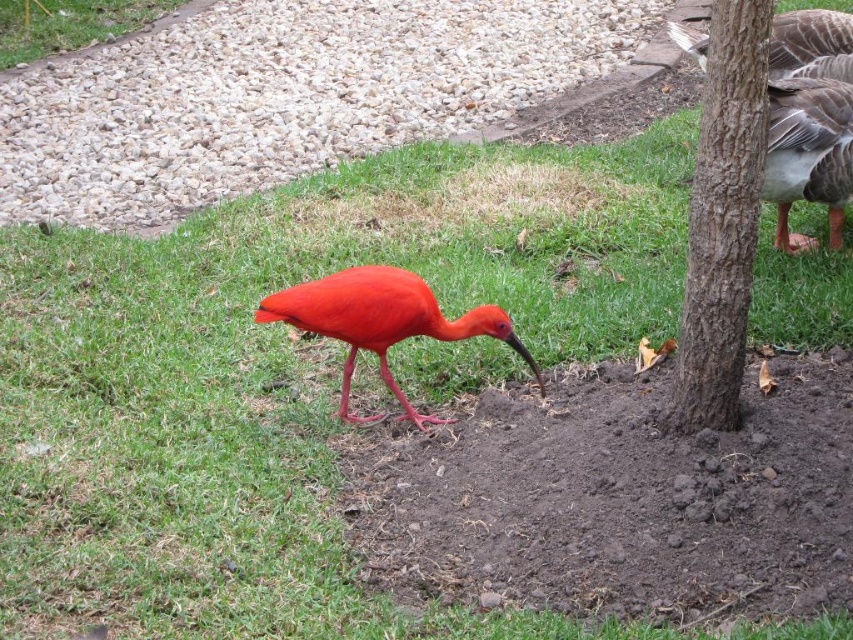
Question: Can you confirm if gray feathered goose at right is positioned below matte red ibis at center?

Choices:
 (A) yes
 (B) no

Answer: (B)

Question: Which point is closer to the camera taking this photo?

Choices:
 (A) (531, 355)
 (B) (90, 28)
 (C) (697, 348)
 (D) (843, 24)

Answer: (C)

Question: Estimate the real-world distances between objects in this image. Which object is farther from the gray feathered goose at right?

Choices:
 (A) green grass at upper left
 (B) matte red ibis at center

Answer: (A)

Question: Is gray feathered goose at right above matte red ibis at center?

Choices:
 (A) yes
 (B) no

Answer: (A)

Question: In this image, where is brown rough bark at right located relative to green grass at upper left?

Choices:
 (A) above
 (B) below

Answer: (B)

Question: Which point is closer to the camera taking this photo?

Choices:
 (A) (62, 35)
 (B) (833, 45)

Answer: (B)